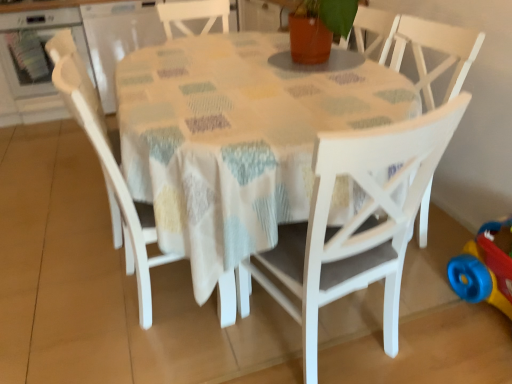
Describe the element at coordinates (486, 267) in the screenshot. I see `rubberized plastic toy at lower right` at that location.

At what (x,y) coordinates should I click in order to perform the action: click on brushed metal oven at upper left. Please return your answer as a coordinate pair (x, y). This screenshot has height=384, width=512. Looking at the image, I should click on (36, 48).

In order to face white matte chair at center, the 3th chair positioned from the left, should I rotate leftwards or rightwards?

Turn right approximately 9.801 degrees to face it.

Describe the element at coordinates (357, 223) in the screenshot. This screenshot has width=512, height=384. I see `white matte chair at center, the 3th chair positioned from the left` at that location.

Identify the location of matte white chair at left, the 1th chair positioned from the left. The width and height of the screenshot is (512, 384). (77, 86).

Image resolution: width=512 pixels, height=384 pixels. What are the coordinates of `rubberized plastic toy at lower right` in the screenshot? It's located at (486, 267).

Considering the relative positions of brushed metal oven at upper left and transparent plastic container at upper left in the image provided, is brushed metal oven at upper left to the right of transparent plastic container at upper left from the viewer's perspective?

No, brushed metal oven at upper left is not to the right of transparent plastic container at upper left.

Which object is closer to the camera taking this photo, brushed metal oven at upper left or transparent plastic container at upper left?

brushed metal oven at upper left is in front.

Is point (108, 177) closer or farther from the camera than point (451, 274)?

Point (108, 177) is closer to the camera than point (451, 274).

Is matte white chair at left, the third chair in the right-to-left sequence, positioned beyond the bounds of rubberized plastic toy at lower right?

matte white chair at left, the third chair in the right-to-left sequence, lies outside rubberized plastic toy at lower right's area.

Does matte white chair at left, the third chair in the right-to-left sequence, lie behind rubberized plastic toy at lower right?

Yes, it is.

Can you confirm if matte white chair at left, the 1th chair positioned from the left, is bigger than rubberized plastic toy at lower right?

Yes.

Is white wood table at center located within white matte chair at center, placed as the 1th chair when sorted from right to left?

No, white wood table at center is located outside of white matte chair at center, placed as the 1th chair when sorted from right to left.

Considering the sizes of white matte chair at center, the 3th chair positioned from the left, and white wood table at center in the image, is white matte chair at center, the 3th chair positioned from the left, bigger or smaller than white wood table at center?

In the image, white matte chair at center, the 3th chair positioned from the left, appears to be smaller than white wood table at center.

Does point (304, 247) come behind point (172, 213)?

No, (304, 247) is closer to viewer.

Is white matte chair at center, the 3th chair positioned from the left, behind white wood table at center?

No, white matte chair at center, the 3th chair positioned from the left, is closer to the viewer.

Is white wood table at center positioned behind white wood chair at center, which ranks as the second chair in right-to-left order?

No, the depth of white wood table at center is less than that of white wood chair at center, which ranks as the second chair in right-to-left order.

Considering the sizes of white wood table at center and white wood chair at center, which is counted as the 2th chair, starting from the left, in the image, is white wood table at center wider or thinner than white wood chair at center, which is counted as the 2th chair, starting from the left,?

In the image, white wood table at center appears to be wider than white wood chair at center, which is counted as the 2th chair, starting from the left.

Can you confirm if white wood table at center is shorter than white wood chair at center, which is counted as the 2th chair, starting from the left?

Correct, white wood table at center is not as tall as white wood chair at center, which is counted as the 2th chair, starting from the left.

Considering the positions of objects white wood table at center and white wood chair at center, which is counted as the 2th chair, starting from the left, in the image provided, who is more to the right, white wood table at center or white wood chair at center, which is counted as the 2th chair, starting from the left,?

Positioned to the right is white wood table at center.

From the image's perspective, would you say white wood table at center is positioned over white matte chair at center, placed as the 1th chair when sorted from right to left?

Correct, white wood table at center appears higher than white matte chair at center, placed as the 1th chair when sorted from right to left, in the image.

Is white wood table at center located outside white matte chair at center, placed as the 1th chair when sorted from right to left?

That's correct, white wood table at center is outside of white matte chair at center, placed as the 1th chair when sorted from right to left.

Which object is thinner, white wood table at center or white matte chair at center, the 3th chair positioned from the left?

white matte chair at center, the 3th chair positioned from the left, is thinner.

Is white wood table at center turned away from white matte chair at center, the 3th chair positioned from the left?

No, white wood table at center is not facing away from white matte chair at center, the 3th chair positioned from the left.

Considering the sizes of objects rubberized plastic toy at lower right and matte white chair at left, the 1th chair positioned from the left, in the image provided, who is thinner, rubberized plastic toy at lower right or matte white chair at left, the 1th chair positioned from the left,?

With smaller width is rubberized plastic toy at lower right.

Is rubberized plastic toy at lower right not close to matte white chair at left, the 1th chair positioned from the left?

Absolutely, rubberized plastic toy at lower right is distant from matte white chair at left, the 1th chair positioned from the left.

Considering the relative sizes of rubberized plastic toy at lower right and matte white chair at left, the third chair in the right-to-left sequence, in the image provided, is rubberized plastic toy at lower right shorter than matte white chair at left, the third chair in the right-to-left sequence,?

Yes.

Consider the image. Is rubberized plastic toy at lower right bigger than white wood chair at center, which is counted as the 2th chair, starting from the left?

No.

From the image's perspective, which one is positioned lower, rubberized plastic toy at lower right or white wood chair at center, which ranks as the second chair in right-to-left order?

rubberized plastic toy at lower right.

Considering the relative positions of rubberized plastic toy at lower right and white wood chair at center, which is counted as the 2th chair, starting from the left, in the image provided, is rubberized plastic toy at lower right to the left of white wood chair at center, which is counted as the 2th chair, starting from the left, from the viewer's perspective?

No.

Find the location of a particular element. oven below the transparent plastic container at upper left (from a real-world perspective) is located at coordinates (36, 48).

Where is `chair behind the rubberized plastic toy at lower right`? The image size is (512, 384). chair behind the rubberized plastic toy at lower right is located at coordinates (77, 86).

Looking at the image, which one is located further to white wood chair at center, which ranks as the second chair in right-to-left order, white wood table at center or brushed metal oven at upper left?

Based on the image, brushed metal oven at upper left appears to be further to white wood chair at center, which ranks as the second chair in right-to-left order.

Considering their positions, is transparent plastic container at upper left positioned closer to matte white chair at left, the third chair in the right-to-left sequence, than white wood chair at center, which ranks as the second chair in right-to-left order?

Among the two, white wood chair at center, which ranks as the second chair in right-to-left order, is located nearer to matte white chair at left, the third chair in the right-to-left sequence.

Based on their spatial positions, is brushed metal oven at upper left or matte white chair at left, the 1th chair positioned from the left, closer to transparent plastic container at upper left?

The object closer to transparent plastic container at upper left is brushed metal oven at upper left.

Which object lies nearer to the anchor point white wood table at center, white matte chair at center, the 3th chair positioned from the left, or rubberized plastic toy at lower right?

Based on the image, white matte chair at center, the 3th chair positioned from the left, appears to be nearer to white wood table at center.

Which object lies further to the anchor point white matte chair at center, placed as the 1th chair when sorted from right to left, rubberized plastic toy at lower right or brushed metal oven at upper left?

brushed metal oven at upper left lies further to white matte chair at center, placed as the 1th chair when sorted from right to left, than the other object.

When comparing their distances from brushed metal oven at upper left, does white wood chair at center, which ranks as the second chair in right-to-left order, or white matte chair at center, placed as the 1th chair when sorted from right to left, seem further?

white matte chair at center, placed as the 1th chair when sorted from right to left, is positioned further to the anchor brushed metal oven at upper left.

Based on their spatial positions, is matte white chair at left, the third chair in the right-to-left sequence, or transparent plastic container at upper left further from white wood table at center?

Among the two, transparent plastic container at upper left is located further to white wood table at center.

Based on their spatial positions, is brushed metal oven at upper left or white wood chair at center, which ranks as the second chair in right-to-left order, closer to white wood table at center?

Among the two, white wood chair at center, which ranks as the second chair in right-to-left order, is located nearer to white wood table at center.

Identify the location of table between white wood chair at center, which ranks as the second chair in right-to-left order, and white matte chair at center, placed as the 1th chair when sorted from right to left, in the horizontal direction. (238, 137).

I want to click on toy between white matte chair at center, the 3th chair positioned from the left, and transparent plastic container at upper left from front to back, so click(x=486, y=267).

The image size is (512, 384). In order to click on chair between matte white chair at left, the 1th chair positioned from the left, and white wood table at center, in the horizontal direction in this screenshot , I will do `click(112, 176)`.

Identify the location of table positioned between white matte chair at center, the 3th chair positioned from the left, and brushed metal oven at upper left from near to far. (238, 137).